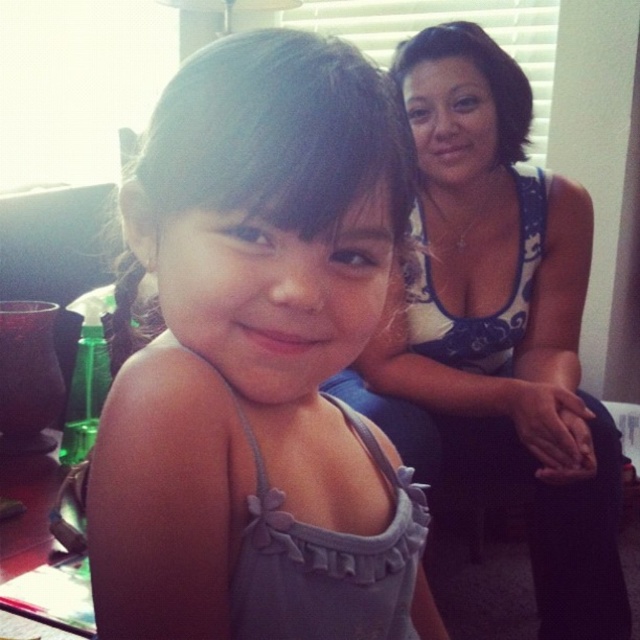
Between matte gray tank top at center and white floral tank top at upper right, which one has less height?

With less height is matte gray tank top at center.

Looking at this image, does matte gray tank top at center have a lesser width compared to white floral tank top at upper right?

Correct, matte gray tank top at center's width is less than white floral tank top at upper right's.

Between point (173, 604) and point (566, 470), which one is positioned in front?

Point (173, 604) is more forward.

Identify the location of matte gray tank top at center. (259, 362).